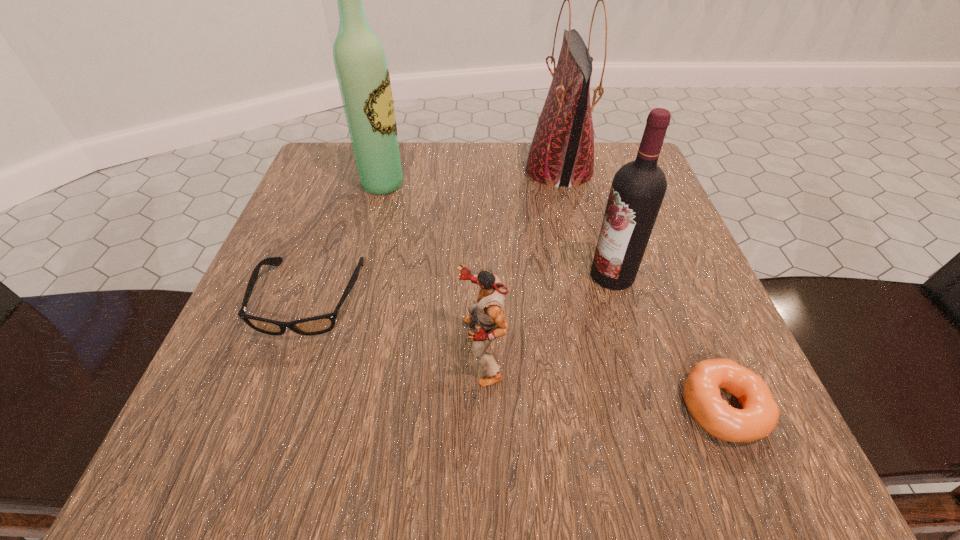
This screenshot has height=540, width=960. Identify the location of vacant space located on the front of the handbag. (590, 308).

Find the location of a particular element. This screenshot has height=540, width=960. free space located 0.280m on the label of the nearer wine bottle is located at coordinates (425, 275).

Image resolution: width=960 pixels, height=540 pixels. What are the coordinates of `free space located on the label of the nearer wine bottle` in the screenshot? It's located at (491, 275).

Where is `vacant point located 0.200m on the label of the nearer wine bottle`? The width and height of the screenshot is (960, 540). vacant point located 0.200m on the label of the nearer wine bottle is located at coordinates (472, 275).

You are a GUI agent. You are given a task and a screenshot of the screen. Output one action in this format:
    pyautogui.click(x=<x>, y=<y>)
    Task: Click on the vacant space located on the front-facing side of the third object from left to right
    
    Given the screenshot: What is the action you would take?
    pyautogui.click(x=362, y=350)

You are a GUI agent. You are given a task and a screenshot of the screen. Output one action in this format:
    pyautogui.click(x=<x>, y=<y>)
    Task: Click on the vacant space located 0.310m on the front-facing side of the third object from left to right
    The width and height of the screenshot is (960, 540).
    Given the screenshot: What is the action you would take?
    pyautogui.click(x=245, y=350)

The image size is (960, 540). What are the coordinates of `vacant space positioned 0.150m on the front-facing side of the third object from left to right` in the screenshot? It's located at (355, 350).

The height and width of the screenshot is (540, 960). Find the location of `free space located 0.090m on the front-facing side of the spectacles`. free space located 0.090m on the front-facing side of the spectacles is located at coordinates pyautogui.click(x=274, y=397).

The height and width of the screenshot is (540, 960). What are the coordinates of `vacant region located on the left of the doughnut` in the screenshot? It's located at (385, 407).

This screenshot has width=960, height=540. I want to click on wine bottle at the far edge, so click(x=362, y=72).